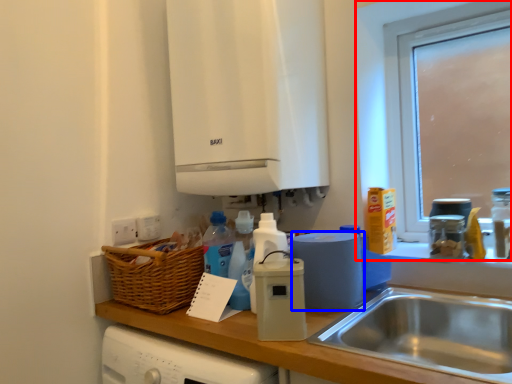
Question: Which object appears closest to the camera in this image, window (highlighted by a red box) or kitchen appliance (highlighted by a blue box)?

Choices:
 (A) window
 (B) kitchen appliance

Answer: (B)